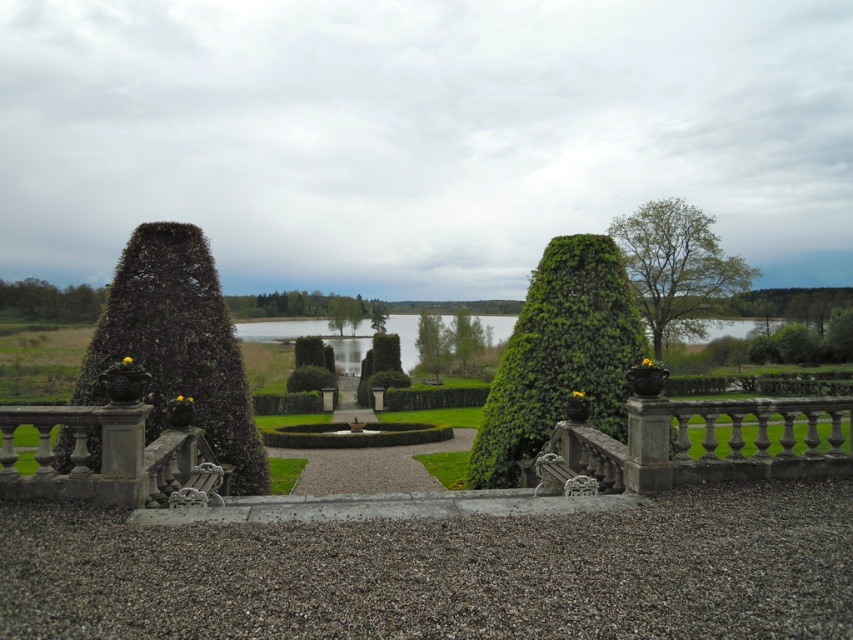
Question: Which object is positioned closest to the gray gravel at lower center?

Choices:
 (A) green leafy tree at upper right
 (B) green leafy bush at left
 (C) green leafy tree at upper left

Answer: (B)

Question: Can you confirm if green leafy bush at center is bigger than green leafy tree at upper right?

Choices:
 (A) yes
 (B) no

Answer: (B)

Question: Which point appears farthest from the camera in this image?

Choices:
 (A) (614, 484)
 (B) (6, 307)

Answer: (B)

Question: Estimate the real-world distances between objects in this image. Which object is farther from the green leafy tree at upper left?

Choices:
 (A) stone balustrade at lower left
 (B) gray gravel at lower center
 (C) green leafy tree at upper right
 (D) green leafy bush at center

Answer: (B)

Question: Is gray gravel at lower center bigger than stone balustrade at center?

Choices:
 (A) no
 (B) yes

Answer: (A)

Question: Does gray gravel at lower center have a greater width compared to green leafy bush at left?

Choices:
 (A) yes
 (B) no

Answer: (B)